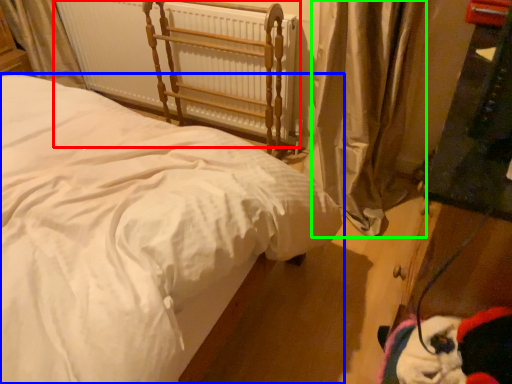
Question: Estimate the real-world distances between objects in this image. Which object is farther from radiator (highlighted by a red box), bed (highlighted by a blue box) or curtain (highlighted by a green box)?

Choices:
 (A) bed
 (B) curtain

Answer: (A)